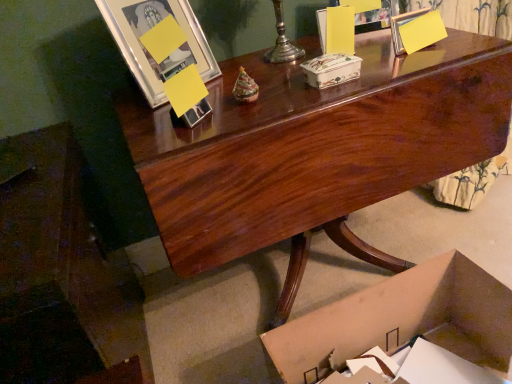
Identify the location of free location to the right of metallic silver picture frame at upper left, marked as the second picture frame in a right-to-left arrangement. (247, 72).